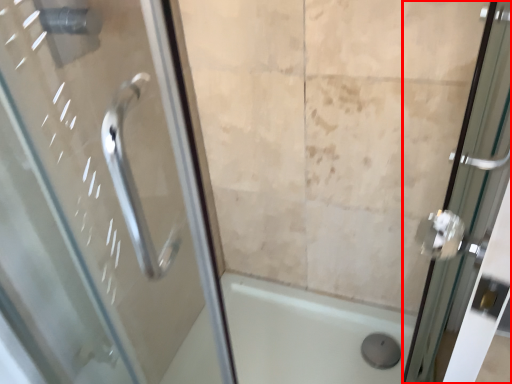
Question: Where is door (annotated by the red box) located in relation to bath in the image?

Choices:
 (A) right
 (B) left

Answer: (A)